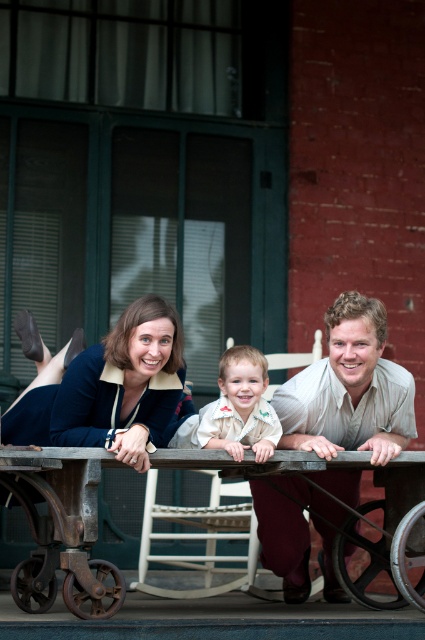
Question: Does matte blue shirt at center come behind light brown wood table at center?

Choices:
 (A) no
 (B) yes

Answer: (A)

Question: Which is nearer to the rusty metal wagon at lower center?

Choices:
 (A) matte blue shirt at center
 (B) light beige shirt at center
 (C) matte blue blouse at center

Answer: (A)

Question: Which of the following is the closest to the observer?

Choices:
 (A) matte blue blouse at center
 (B) light brown wood table at center
 (C) light beige shirt at center
 (D) matte blue shirt at center

Answer: (D)

Question: Estimate the real-world distances between objects in this image. Which object is closer to the matte blue blouse at center?

Choices:
 (A) rusty metal wagon at lower center
 (B) matte blue shirt at center

Answer: (B)

Question: Does light brown wood table at center appear over light beige shirt at center?

Choices:
 (A) no
 (B) yes

Answer: (B)

Question: Is matte blue shirt at center above light beige shirt at center?

Choices:
 (A) yes
 (B) no

Answer: (B)